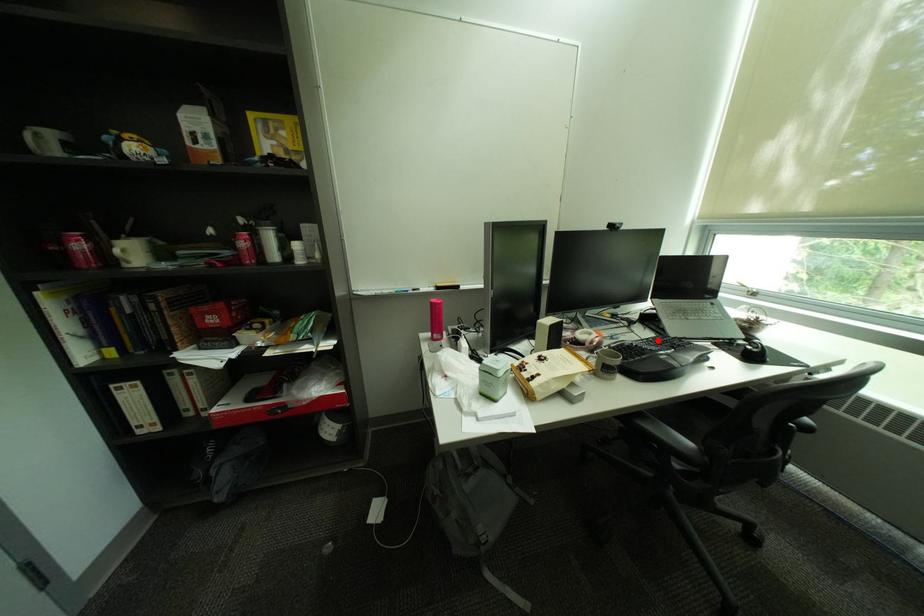
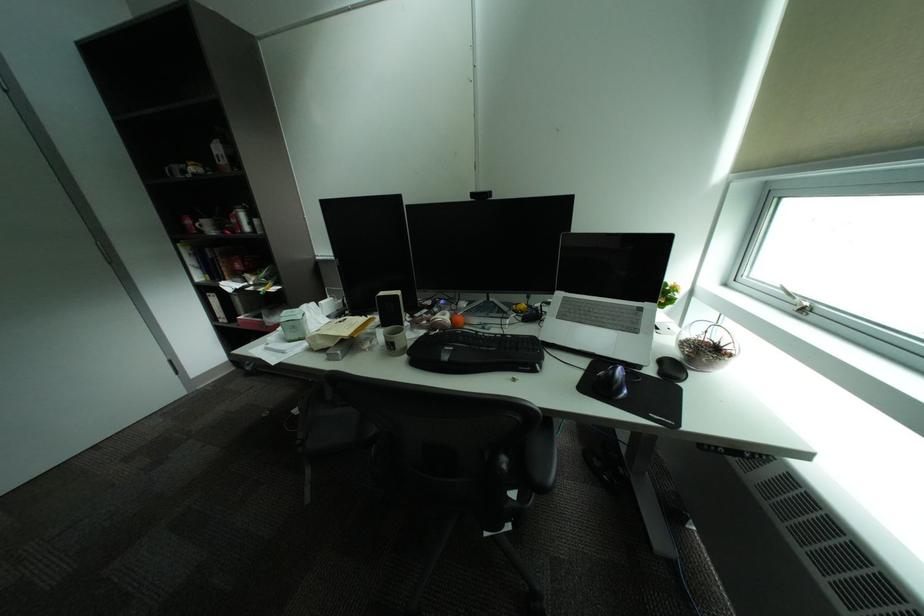
The point at the highlighted location is marked in the first image. Where is the corresponding point in the second image?

(516, 336)